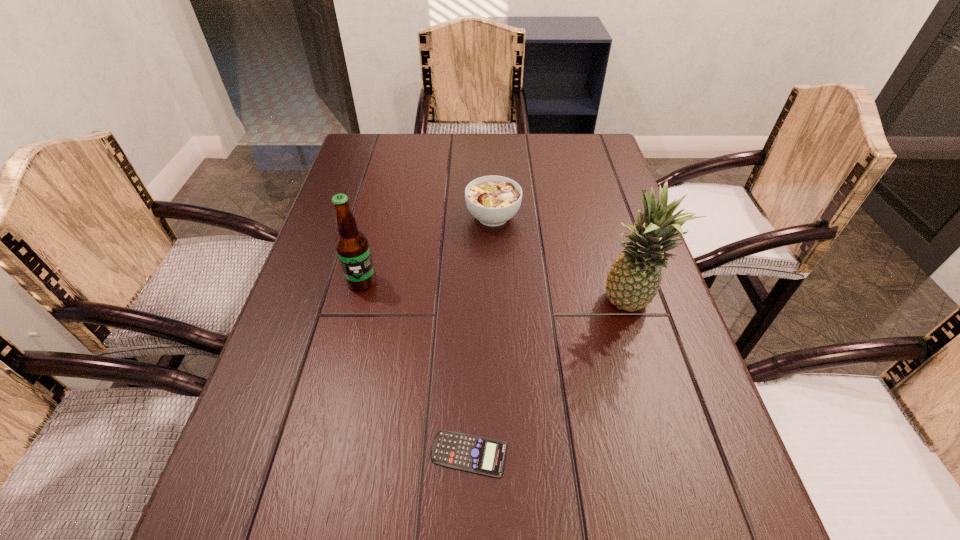
Find the location of a particular element. The image size is (960, 540). free location that satisfies the following two spatial constraints: 1. on the label of the rightmost object; 2. on the left side of the leftmost object is located at coordinates (356, 305).

Where is `vacant area that satisfies the following two spatial constraints: 1. on the label of the beer bottle; 2. on the left side of the shortest object`? Image resolution: width=960 pixels, height=540 pixels. vacant area that satisfies the following two spatial constraints: 1. on the label of the beer bottle; 2. on the left side of the shortest object is located at coordinates (318, 454).

Find the location of a particular element. vacant space that satisfies the following two spatial constraints: 1. on the label of the leftmost object; 2. on the right side of the calculator is located at coordinates (318, 454).

Identify the location of vacant area that satisfies the following two spatial constraints: 1. on the label of the leftmost object; 2. on the left side of the shortest object. point(318,454).

Identify the location of vacant point that satisfies the following two spatial constraints: 1. on the label of the pineapple; 2. on the left side of the third shortest object. The width and height of the screenshot is (960, 540). (356, 305).

Locate an element on the screen. free point that satisfies the following two spatial constraints: 1. on the label of the tallest object; 2. on the right side of the beer bottle is located at coordinates (356, 305).

You are a GUI agent. You are given a task and a screenshot of the screen. Output one action in this format:
    pyautogui.click(x=<x>, y=<y>)
    Task: Click on the free space that satisfies the following two spatial constraints: 1. on the label of the leftmost object; 2. on the left side of the calculator
    Image resolution: width=960 pixels, height=540 pixels.
    Given the screenshot: What is the action you would take?
    pyautogui.click(x=318, y=454)